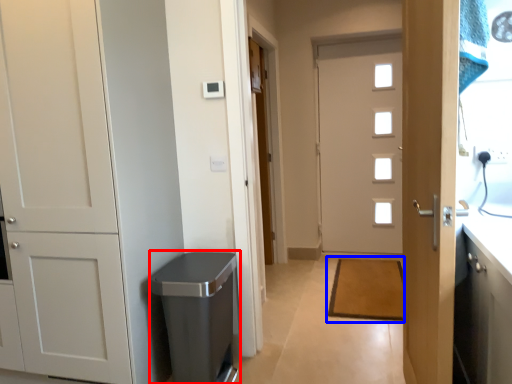
Question: Which object is further to the camera taking this photo, dish washer (highlighted by a red box) or doormat (highlighted by a blue box)?

Choices:
 (A) dish washer
 (B) doormat

Answer: (B)